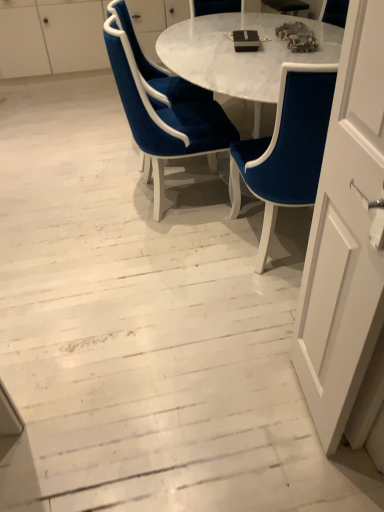
At what (x,y) coordinates should I click in order to perform the action: click on free region under velvet blue chair at center, acting as the 2th chair starting from the right (from a real-world perspective). Please return your answer as a coordinate pair (x, y). Image resolution: width=384 pixels, height=512 pixels. Looking at the image, I should click on pyautogui.click(x=143, y=198).